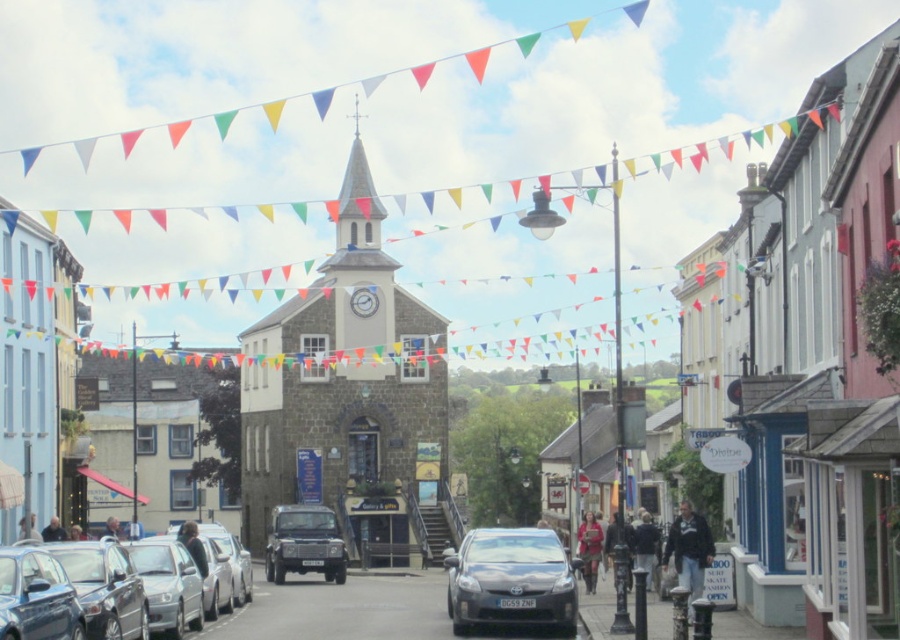
You are a delivery person who needs to park your truck next to the metallic silver car at center and the metallic gray sedan at center. Which vehicle should you park behind to ensure there is enough space for your truck?

You should park behind the metallic gray sedan at center because it is longer than the metallic silver car at center, providing more space for your truck.

You are a delivery person who needs to park your 1.5 meter tall delivery van. You see the metallic blue car at lower left and the matte black suv at center. Which vehicle has enough space for your van to park between them?

The metallic blue car at lower left is not as tall as the matte black suv at center, so the space between them may not be sufficient for a 1.5 meter tall delivery van. However, since the exact distance between the vehicles isn

You are standing in the street scene looking at the church and the bunting flags. There are two points marked on the image. Which of the two points, point (36, 627) or point (279, 531), is closer to you?

Point (36, 627) is closer to the camera than point (279, 531).